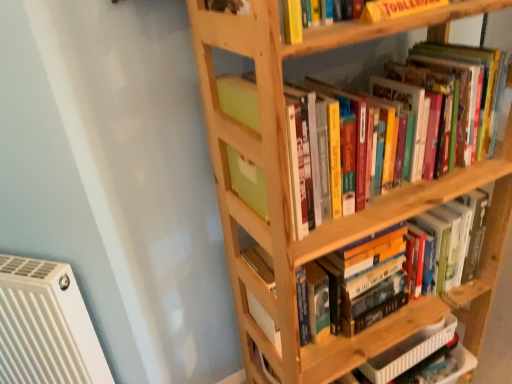
Question: From a real-world perspective, is white plastic radiator at lower left physically located above or below yellow cardboard toblerone at upper center?

Choices:
 (A) below
 (B) above

Answer: (A)

Question: Relative to yellow cardboard toblerone at upper center, is white plastic radiator at lower left in front or behind?

Choices:
 (A) front
 (B) behind

Answer: (B)

Question: Considering the real-world distances, which object is farthest from the hardcover books at center, acting as the 2th book starting from the bottom?

Choices:
 (A) yellow cardboard toblerone at upper center
 (B) wooden bookshelf at center, the 1th book when ordered from top to bottom
 (C) natural wood bookshelf at upper right
 (D) hardcover book at lower right, the third book from the top
 (E) white plastic radiator at lower left

Answer: (E)

Question: Which of these objects is positioned farthest from the wooden bookshelf at center, the 1th book when ordered from top to bottom?

Choices:
 (A) white plastic radiator at lower left
 (B) natural wood bookshelf at upper right
 (C) hardcover books at center, the second book viewed from the top
 (D) hardcover book at lower right, the third book from the top
 (E) yellow cardboard toblerone at upper center

Answer: (A)